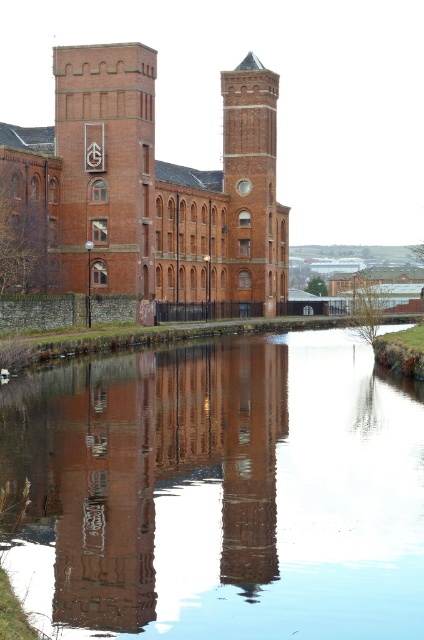
Is point (111, 118) positioned after point (248, 164)?

No, it is in front of (248, 164).

Locate an element on the screen. matte brick tower at left is located at coordinates (106, 168).

Does smooth water at center have a greater height compared to brick tower at center?

No.

This screenshot has height=640, width=424. I want to click on smooth water at center, so click(215, 492).

The image size is (424, 640). Describe the element at coordinates (215, 492) in the screenshot. I see `smooth water at center` at that location.

Locate an element on the screen. smooth water at center is located at coordinates (215, 492).

Is smooth water at center bigger than matte brick tower at left?

Yes, smooth water at center is bigger than matte brick tower at left.

Who is positioned more to the right, smooth water at center or matte brick tower at left?

smooth water at center is more to the right.

Locate an element on the screen. smooth water at center is located at coordinates (215, 492).

This screenshot has height=640, width=424. Identify the location of smooth water at center. (215, 492).